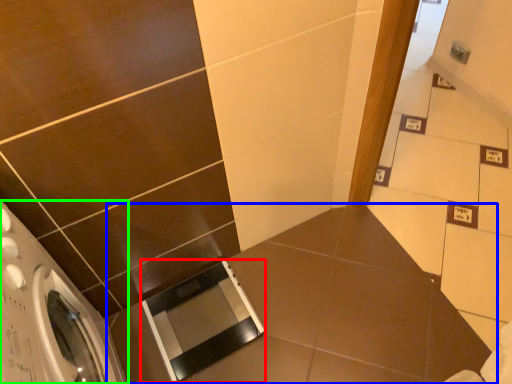
Question: Which object is the closest to the screen door (highlighted by a red box)? Choose among these: counter top (highlighted by a blue box) or washing machine (highlighted by a green box).

Choices:
 (A) counter top
 (B) washing machine

Answer: (A)